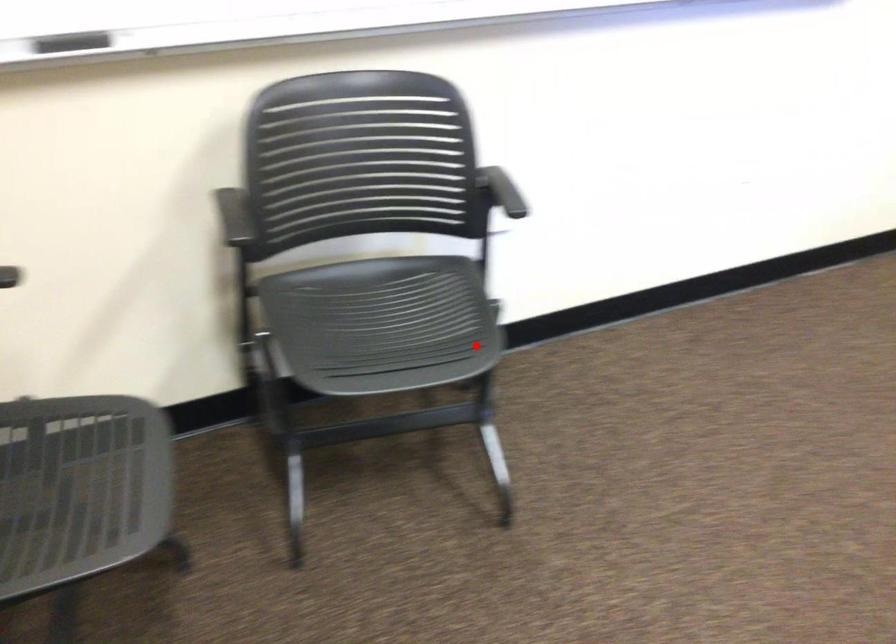
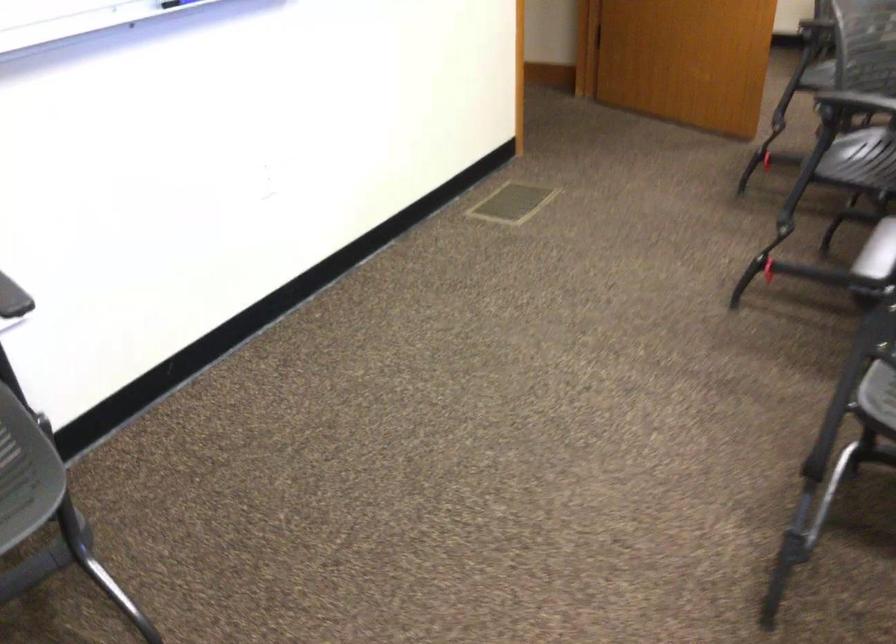
Question: I am providing you with two images of the same scene from different viewpoints. A red point is shown in image1. For the corresponding object point in image2, is it positioned nearer or farther from the camera?

Choices:
 (A) Nearer
 (B) Farther

Answer: (A)